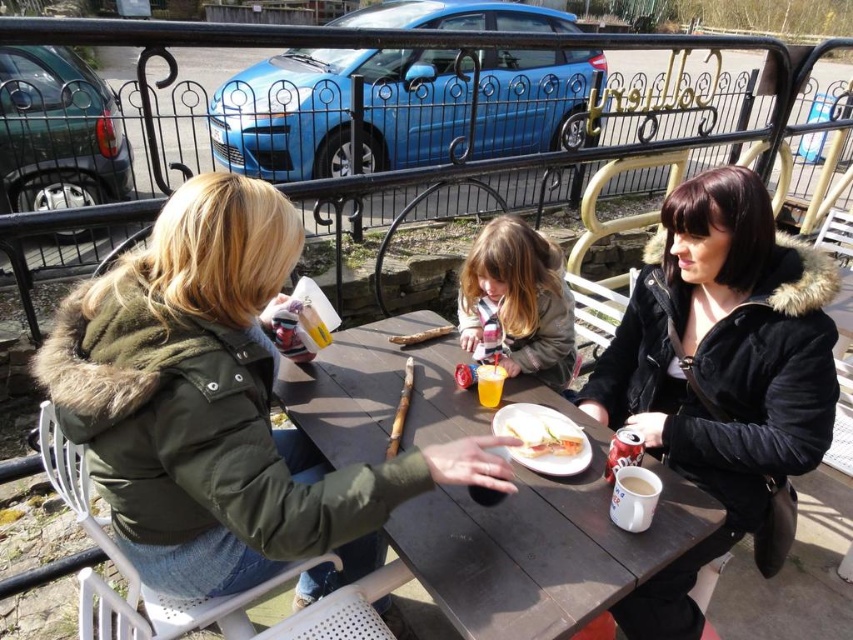
You are standing at the point marked by the coordinates point (219, 408) in the image. Looking around, you see the green fuzzy jacket at center. What object is directly in front of you?

The point (219, 408) indicates the green fuzzy jacket at center, so the object directly in front of you is the green fuzzy jacket at center.

You are standing at the edge of the outdoor dining area and want to place a 3.5 feet long banner between yourself and the wooden table at center. Can you fit the banner without it overlapping the table?

The wooden table at center is 3.34 feet away from the viewer. Since the banner is 3.5 feet long, it would slightly overlap the table, so it cannot be placed without overlapping.